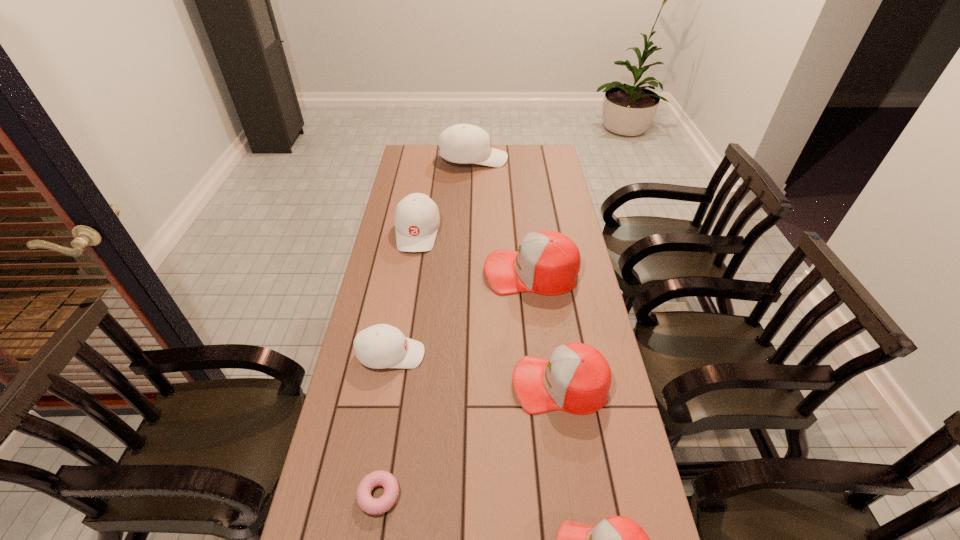
Identify the location of baseball cap object that ranks as the second closest to the smallest red baseball cap. pos(380,346).

You are a GUI agent. You are given a task and a screenshot of the screen. Output one action in this format:
    pyautogui.click(x=<x>, y=<y>)
    Task: Click on the white baseball cap that stands as the third closest to the second farthest red baseball cap
    
    Given the screenshot: What is the action you would take?
    pyautogui.click(x=463, y=143)

Identify which white baseball cap is located as the third nearest to the doughnut. Please provide its 2D coordinates. Your answer should be formatted as a tuple, i.e. [(x, y)], where the tuple contains the x and y coordinates of a point satisfying the conditions above.

[(463, 143)]

Point out which red baseball cap is positioned as the nearest to the nearest white baseball cap. Please provide its 2D coordinates. Your answer should be formatted as a tuple, i.e. [(x, y)], where the tuple contains the x and y coordinates of a point satisfying the conditions above.

[(547, 262)]

Where is `red baseball cap that is the nearest to the smallest red baseball cap`? The height and width of the screenshot is (540, 960). red baseball cap that is the nearest to the smallest red baseball cap is located at coordinates (577, 378).

What are the coordinates of `blank area in the image that satisfies the following two spatial constraints: 1. on the front-facing side of the biggest white baseball cap; 2. on the front-facing side of the second biggest white baseball cap` in the screenshot? It's located at (471, 232).